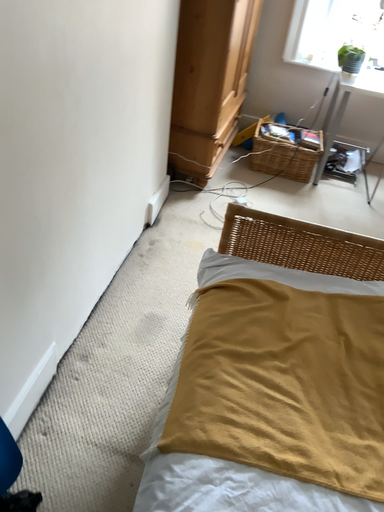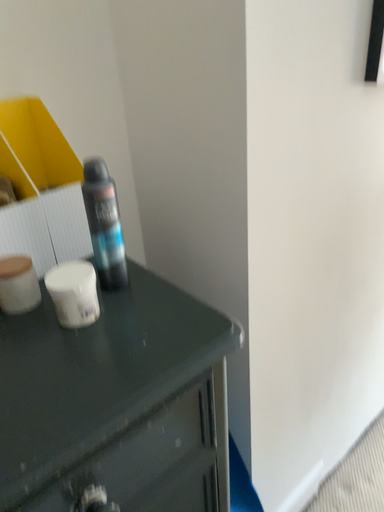
Question: How did the camera likely rotate when shooting the video?

Choices:
 (A) rotated downward
 (B) rotated upward

Answer: (B)